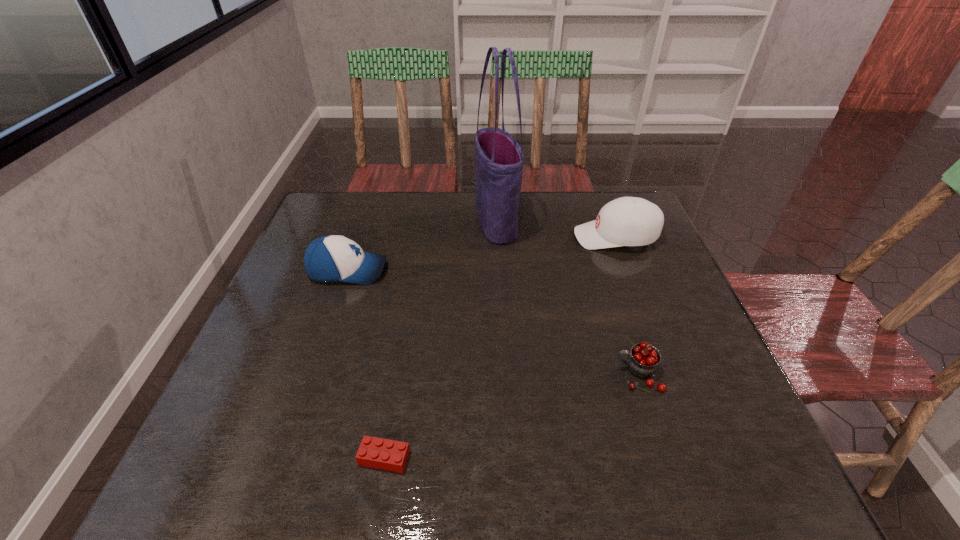
You are a GUI agent. You are given a task and a screenshot of the screen. Output one action in this format:
    pyautogui.click(x=<x>, y=<y>)
    Task: Click on the empty space that is in between the tote bag and the cherry
    
    Given the screenshot: What is the action you would take?
    pyautogui.click(x=567, y=299)

Where is `blank region between the right baseball cap and the cherry`? blank region between the right baseball cap and the cherry is located at coordinates (627, 306).

Where is `empty location between the leftmost object and the tallest object`? empty location between the leftmost object and the tallest object is located at coordinates [422, 247].

At what (x,y) coordinates should I click in order to perform the action: click on empty space that is in between the cherry and the shortest object. Please return your answer as a coordinate pair (x, y). This screenshot has height=540, width=960. Looking at the image, I should click on (512, 416).

In order to click on vacant space that's between the right baseball cap and the left baseball cap in this screenshot , I will do `click(482, 254)`.

Locate an element on the screen. free point between the nearer baseball cap and the right baseball cap is located at coordinates (482, 254).

Locate an element on the screen. vacant area between the cherry and the farther baseball cap is located at coordinates (627, 306).

Where is `vacant space in between the Lego and the tallest object`? Image resolution: width=960 pixels, height=540 pixels. vacant space in between the Lego and the tallest object is located at coordinates (441, 341).

The height and width of the screenshot is (540, 960). I want to click on the closest object to the second nearest object, so click(x=627, y=221).

Select which object is the fourth closest to the nearer baseball cap. Please provide its 2D coordinates. Your answer should be formatted as a tuple, i.e. [(x, y)], where the tuple contains the x and y coordinates of a point satisfying the conditions above.

[(643, 361)]